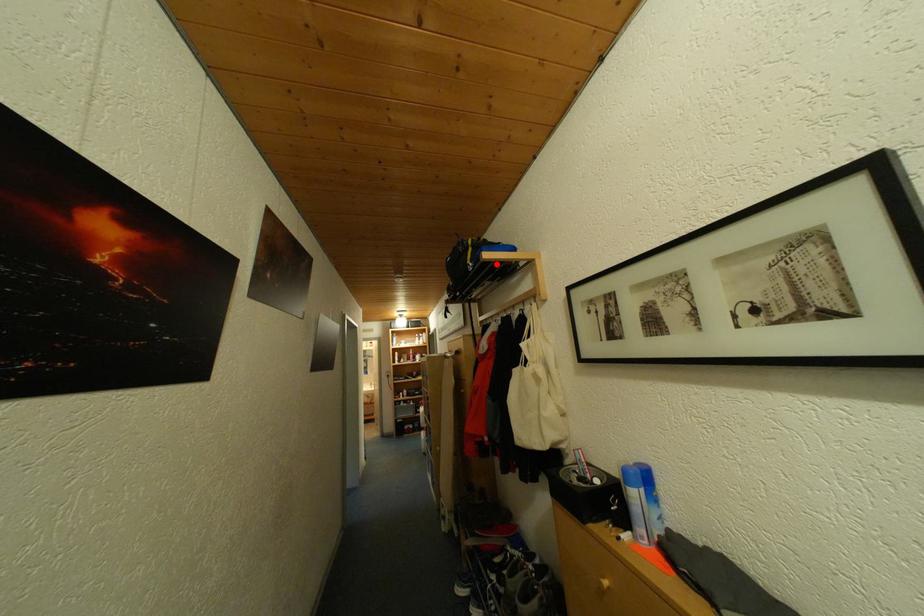
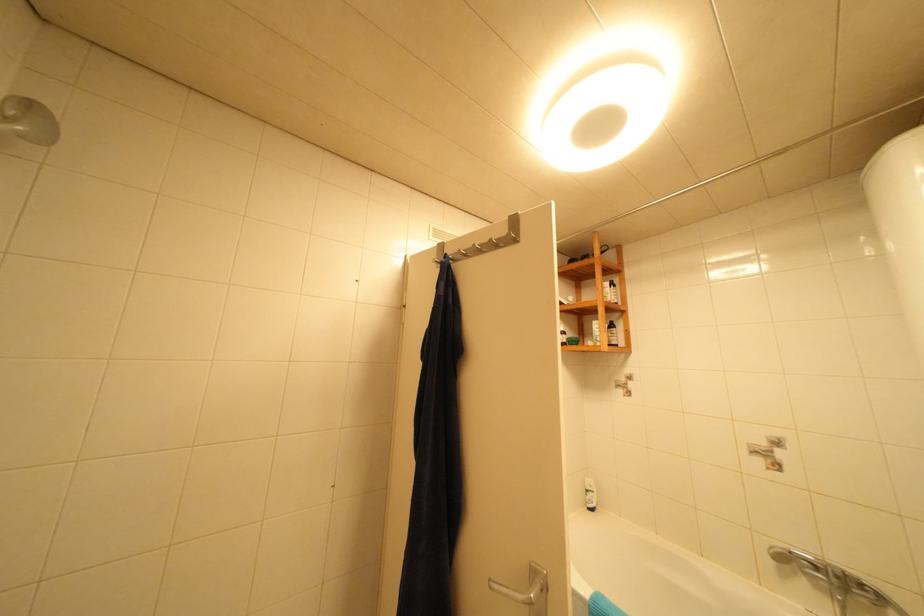
Question: I am providing you with two images of the same scene from different viewpoints. A red point is marked on the first image. Is the red point's position out of view in image 2?

Choices:
 (A) Yes
 (B) No

Answer: (A)